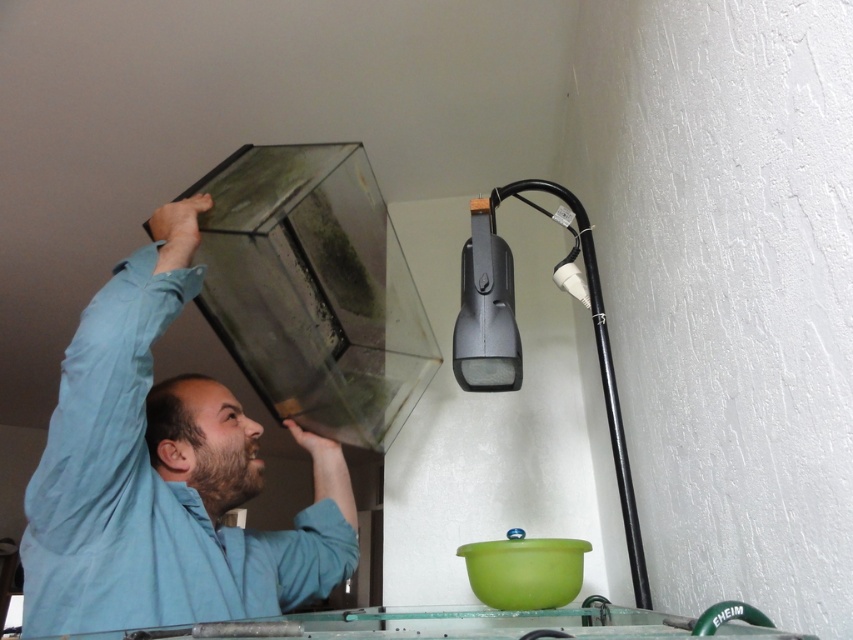
You are a photographer setting up a shoot in this room. You need to position a spotlight so it illuminates both the blue cotton shirt at upper left and the black plastic lamp at upper right. Considering their positions, which object should the spotlight be placed closer to?

The spotlight should be placed closer to the blue cotton shirt at upper left because it is closer to the viewer than the black plastic lamp at upper right, so the light source needs to be nearer to ensure both are adequately lit.

You are a fashion designer observing the scene. You need to decide which item is more suitable for a vertical display in a store window. Which object should you choose between the blue cotton shirt at upper left and the black plastic lamp at upper right?

The blue cotton shirt at upper left is much taller than the black plastic lamp at upper right, so it would be more suitable for a vertical display in a store window.

Where is the blue cotton shirt at upper left located in the image?

The blue cotton shirt at upper left is located at point (164, 476) in the image.